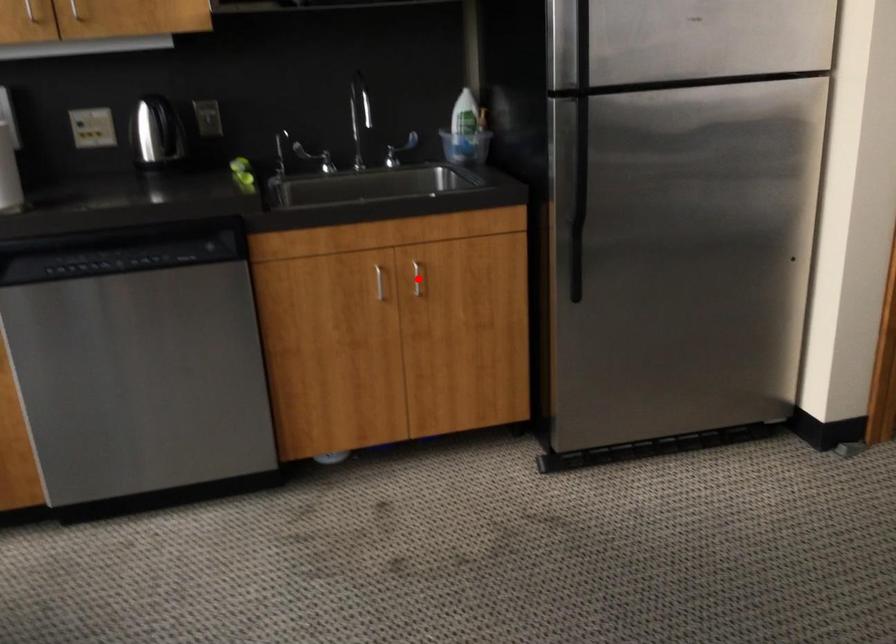
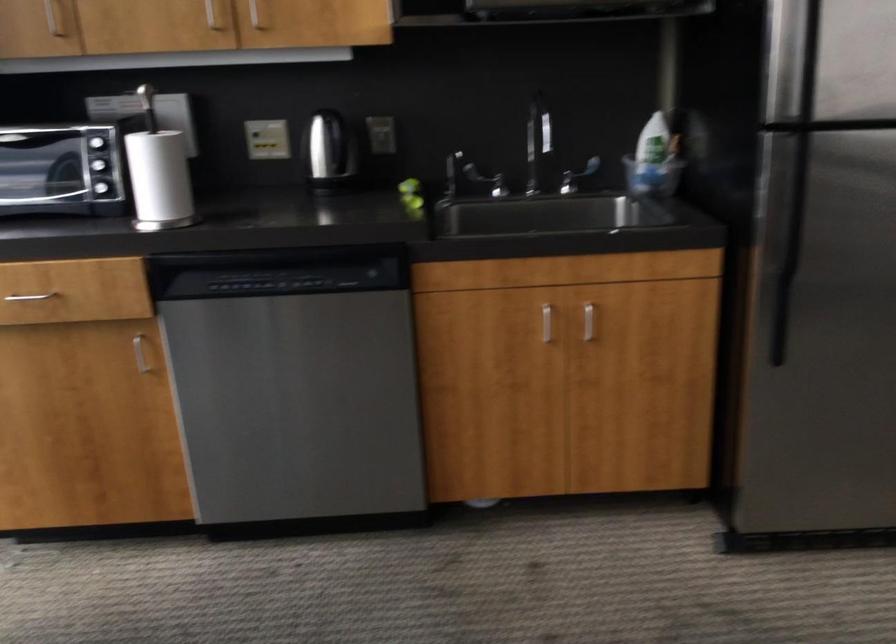
Locate, in the second image, the point that corresponds to the highlighted location in the first image.

(588, 321)